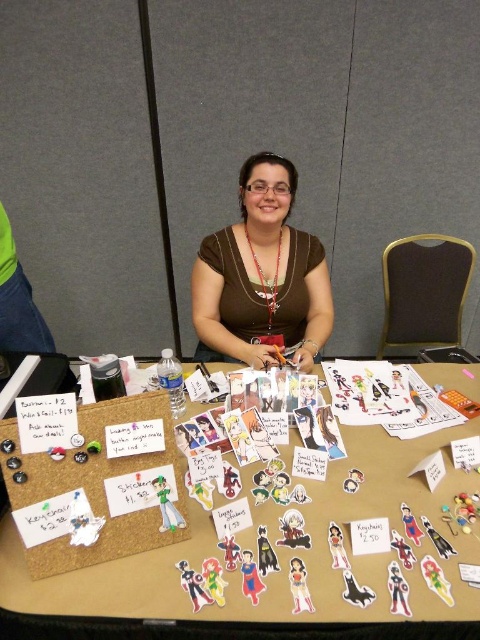
Who is more forward, (313, 602) or (260, 280)?

Positioned in front is point (313, 602).

You are a GUI agent. You are given a task and a screenshot of the screen. Output one action in this format:
    pyautogui.click(x=<x>, y=<y>)
    Task: Click on the corkboard at center
    This screenshot has height=640, width=480.
    Given the screenshot: What is the action you would take?
    pyautogui.click(x=290, y=550)

Is point (208, 529) positioned in front of point (276, 253)?

Yes, point (208, 529) is closer to viewer.

Locate an element on the screen. The image size is (480, 640). corkboard at center is located at coordinates (290, 550).

Between corkboard at center and brown matte shirt at center, which one is positioned lower?

corkboard at center is below.

Find the location of a particular element. corkboard at center is located at coordinates [x=290, y=550].

Is brown matte shirt at center below silver metallic necklace at center?

Actually, brown matte shirt at center is above silver metallic necklace at center.

Is point (324, 304) positioned after point (264, 282)?

Yes.

At what (x,y) coordinates should I click in order to perform the action: click on brown matte shirt at center. Please return your answer as a coordinate pair (x, y). Looking at the image, I should click on (262, 275).

Locate an element on the screen. The width and height of the screenshot is (480, 640). brown matte shirt at center is located at coordinates (262, 275).